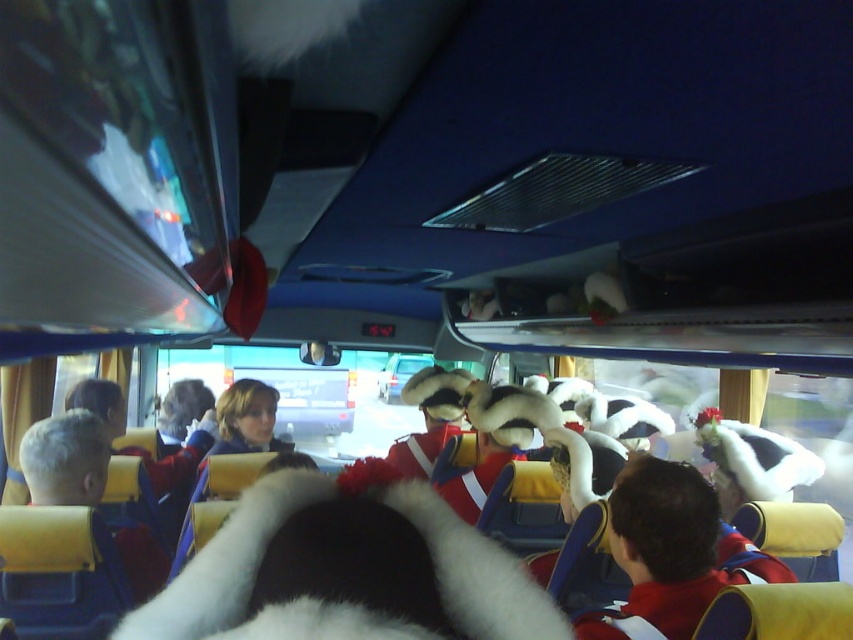
Question: Which object is farther from the camera taking this photo?

Choices:
 (A) gray hair at left
 (B) red fabric uniform at center

Answer: (A)

Question: Can you confirm if red fabric uniform at center is positioned below gray hair at left?

Choices:
 (A) yes
 (B) no

Answer: (B)

Question: Is red fabric uniform at center thinner than gray hair at left?

Choices:
 (A) no
 (B) yes

Answer: (A)

Question: Which point is farther from the camera taking this photo?

Choices:
 (A) (56, 500)
 (B) (669, 586)

Answer: (A)

Question: In this image, where is red fabric uniform at center located relative to gray hair at left?

Choices:
 (A) above
 (B) below

Answer: (A)

Question: Among these objects, which one is farthest from the camera?

Choices:
 (A) red fabric uniform at center
 (B) gray hair at left

Answer: (B)